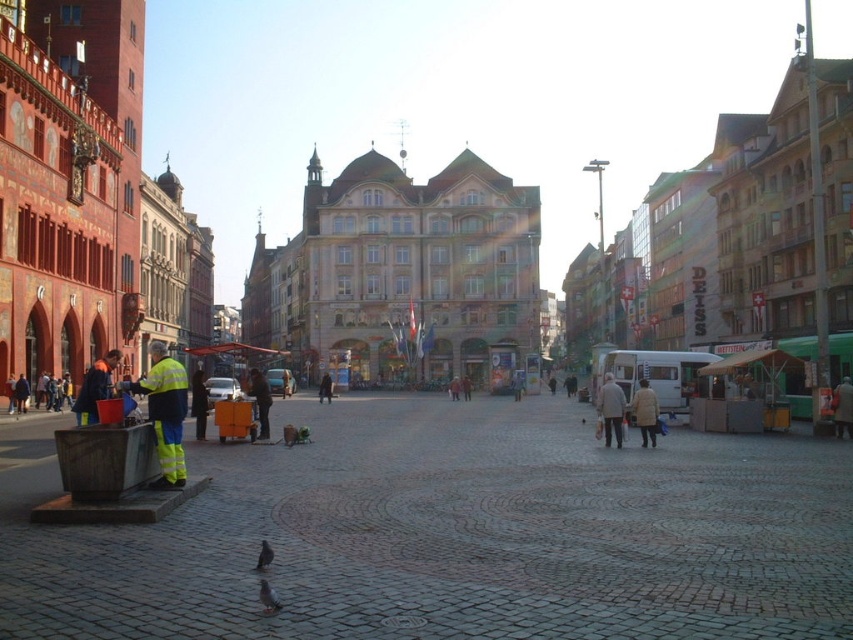
This screenshot has height=640, width=853. What are the coordinates of `yellow reflective jacket at lower left` in the screenshot? It's located at (165, 410).

Is point (170, 380) more distant than point (265, 604)?

Yes, it is.

Identify the location of yellow reflective jacket at lower left. (165, 410).

Between yellow reflective jacket at lower left and gray feathered bird at center, which one appears on the right side from the viewer's perspective?

From the viewer's perspective, gray feathered bird at center appears more on the right side.

This screenshot has width=853, height=640. I want to click on yellow reflective jacket at lower left, so click(x=165, y=410).

This screenshot has height=640, width=853. I want to click on yellow reflective jacket at lower left, so click(165, 410).

Between light beige coat at center and reflective silver jacket at center, which one has less height?

Standing shorter between the two is light beige coat at center.

Is light beige coat at center below reflective silver jacket at center?

Actually, light beige coat at center is above reflective silver jacket at center.

Locate an element on the screen. The image size is (853, 640). light beige coat at center is located at coordinates (611, 410).